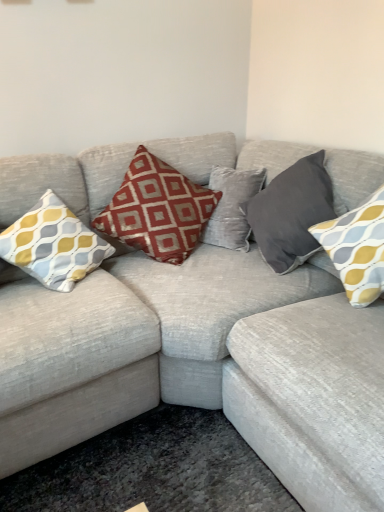
Question: Does dark gray velvet pillow at upper right, which appears as the second pillow when viewed from the right, appear on the right side of textured gray couch at center?

Choices:
 (A) no
 (B) yes

Answer: (B)

Question: From a real-world perspective, is dark gray velvet pillow at upper right, which is the third pillow in left-to-right order, below textured gray couch at center?

Choices:
 (A) no
 (B) yes

Answer: (A)

Question: Is dark gray velvet pillow at upper right, which appears as the second pillow when viewed from the right, touching textured gray couch at center?

Choices:
 (A) no
 (B) yes

Answer: (A)

Question: Is dark gray velvet pillow at upper right, which appears as the second pillow when viewed from the right, shorter than textured gray couch at center?

Choices:
 (A) no
 (B) yes

Answer: (B)

Question: Does dark gray velvet pillow at upper right, which is the third pillow in left-to-right order, have a lesser width compared to textured gray couch at center?

Choices:
 (A) no
 (B) yes

Answer: (B)

Question: From a real-world perspective, is dark gray velvet pillow at upper right, which appears as the second pillow when viewed from the right, positioned over textured gray couch at center based on gravity?

Choices:
 (A) yes
 (B) no

Answer: (A)

Question: From a real-world perspective, is red printed cushion at center, which is the 2th pillow from left to right, located higher than yellow-grey patterned cushion at left, the 4th pillow viewed from the right?

Choices:
 (A) no
 (B) yes

Answer: (A)

Question: Would you say red printed cushion at center, the 3th pillow from the right, contains yellow-grey patterned cushion at left, which ranks as the first pillow in left-to-right order?

Choices:
 (A) yes
 (B) no

Answer: (B)

Question: From the image's perspective, does red printed cushion at center, the 3th pillow from the right, appear lower than yellow-grey patterned cushion at left, which ranks as the first pillow in left-to-right order?

Choices:
 (A) yes
 (B) no

Answer: (B)

Question: Does red printed cushion at center, the 3th pillow from the right, turn towards yellow-grey patterned cushion at left, the 4th pillow viewed from the right?

Choices:
 (A) no
 (B) yes

Answer: (A)

Question: Does red printed cushion at center, which is the 2th pillow from left to right, have a greater height compared to yellow-grey patterned cushion at left, which ranks as the first pillow in left-to-right order?

Choices:
 (A) no
 (B) yes

Answer: (B)

Question: Is red printed cushion at center, the 3th pillow from the right, smaller than yellow-grey patterned cushion at left, which ranks as the first pillow in left-to-right order?

Choices:
 (A) yes
 (B) no

Answer: (B)

Question: From a real-world perspective, is textured gray couch at center below yellow-grey patterned cushion at left, the 4th pillow viewed from the right?

Choices:
 (A) yes
 (B) no

Answer: (A)